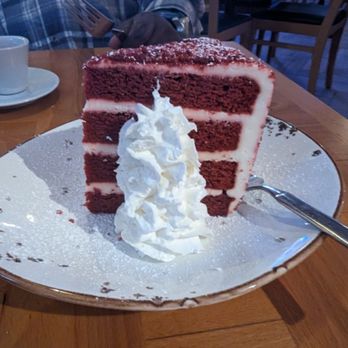
The height and width of the screenshot is (348, 348). Identify the location of table. (311, 301), (289, 108), (66, 102).